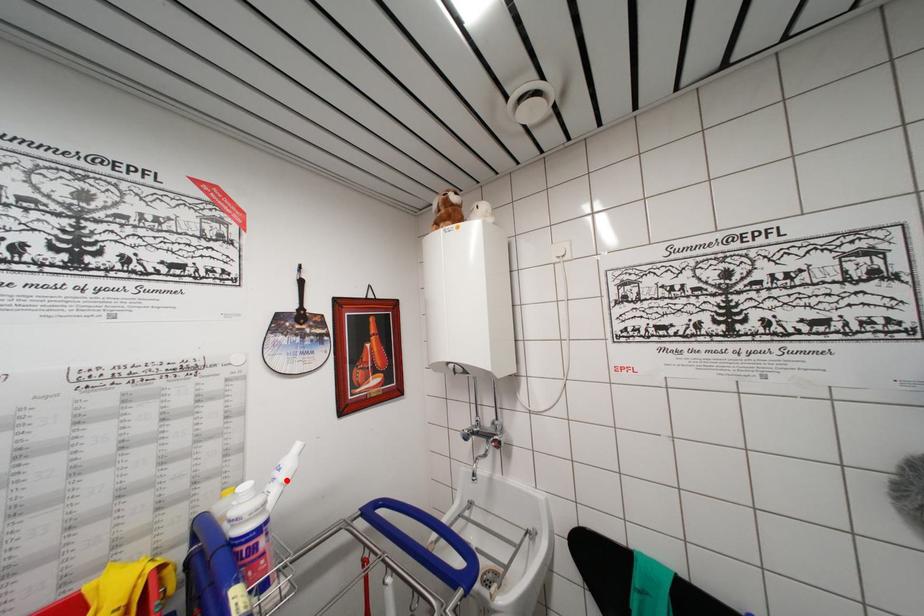
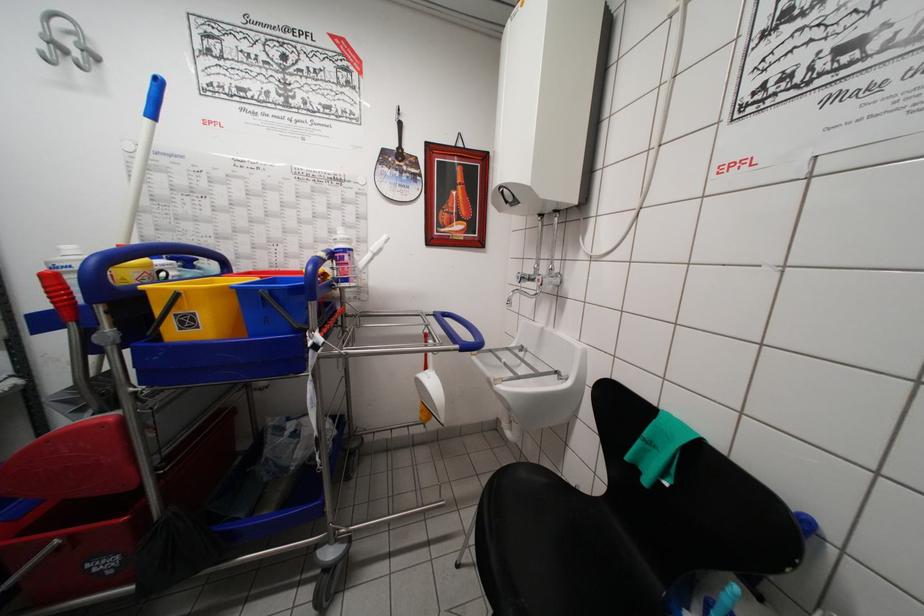
In the second image, find the point that corresponds to the highlighted location in the first image.

(377, 253)